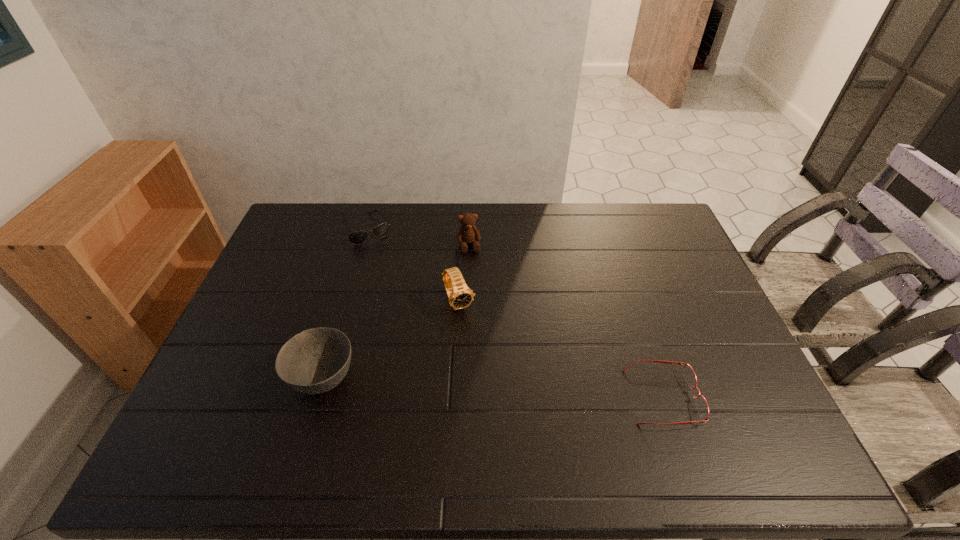
Locate an element on the screen. free space located 0.320m on the face of the teddy bear is located at coordinates (485, 327).

Locate an element on the screen. Image resolution: width=960 pixels, height=540 pixels. free region located 0.340m on the face of the watch is located at coordinates (516, 416).

Identify the location of free space located 0.160m on the face of the watch. The width and height of the screenshot is (960, 540). (487, 359).

Locate an element on the screen. vacant space located 0.090m on the face of the watch is located at coordinates (476, 340).

Locate an element on the screen. This screenshot has height=540, width=960. free point located on the front-facing side of the fourth tallest object is located at coordinates (384, 260).

Where is `vacant space located 0.240m on the front-facing side of the fourth tallest object`? vacant space located 0.240m on the front-facing side of the fourth tallest object is located at coordinates (401, 288).

Where is `vacant space located 0.180m on the front-facing side of the fourth tallest object`? The height and width of the screenshot is (540, 960). vacant space located 0.180m on the front-facing side of the fourth tallest object is located at coordinates (394, 276).

I want to click on teddy bear present at the far edge, so click(468, 233).

You are a GUI agent. You are given a task and a screenshot of the screen. Output one action in this format:
    pyautogui.click(x=<x>, y=<y>)
    Task: Click on the sunglasses that is at the far edge
    The height and width of the screenshot is (540, 960).
    Given the screenshot: What is the action you would take?
    pyautogui.click(x=356, y=238)

What are the coordinates of `bowl present at the near edge` in the screenshot? It's located at (316, 360).